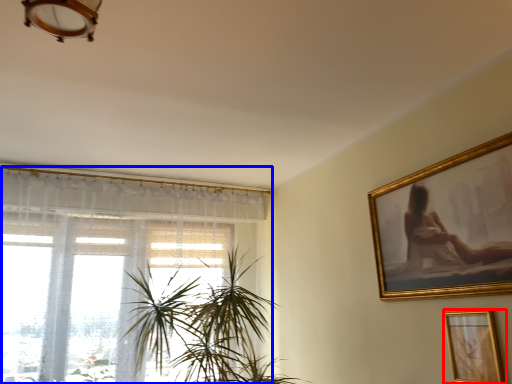
Question: Which of the following is the closest to the observer, picture frame (highlighted by a red box) or window (highlighted by a blue box)?

Choices:
 (A) picture frame
 (B) window

Answer: (A)